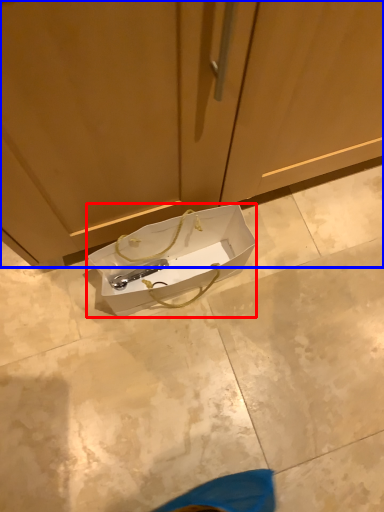
Question: Among these objects, which one is farthest to the camera, box (highlighted by a red box) or cabinetry (highlighted by a blue box)?

Choices:
 (A) box
 (B) cabinetry

Answer: (A)